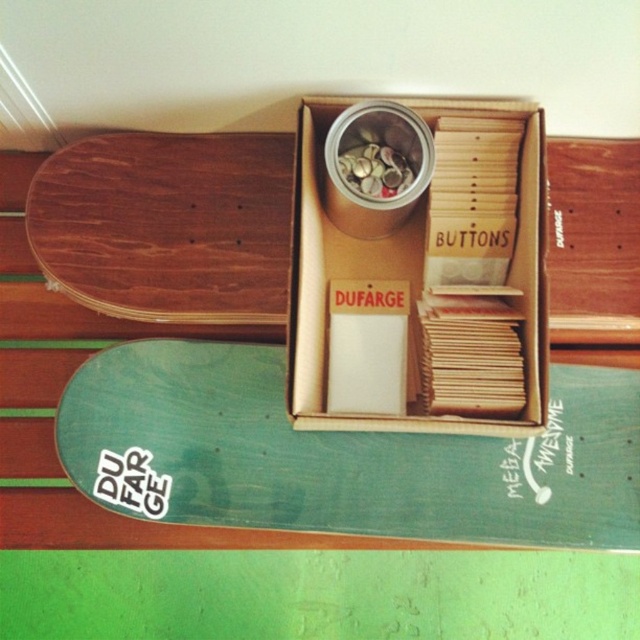
Can you confirm if green matte skateboard at lower left is thinner than brown cardboard box at center?

Incorrect, green matte skateboard at lower left's width is not less than brown cardboard box at center's.

What do you see at coordinates (342, 456) in the screenshot?
I see `green matte skateboard at lower left` at bounding box center [342, 456].

Where is `green matte skateboard at lower left`? The image size is (640, 640). green matte skateboard at lower left is located at coordinates (342, 456).

Which is in front, point (614, 387) or point (172, 204)?

Point (614, 387)

From the picture: Does green matte skateboard at lower left have a larger size compared to wooden skateboard at upper left?

Correct, green matte skateboard at lower left is larger in size than wooden skateboard at upper left.

Is point (417, 499) behind point (244, 214)?

No.

Locate an element on the screen. green matte skateboard at lower left is located at coordinates (342, 456).

Between brown cardboard box at center and wooden skateboard at upper left, which one is positioned higher?

wooden skateboard at upper left is above.

Is point (384, 259) positioned before point (93, 138)?

That is True.

Where is `brown cardboard box at center`? brown cardboard box at center is located at coordinates (419, 272).